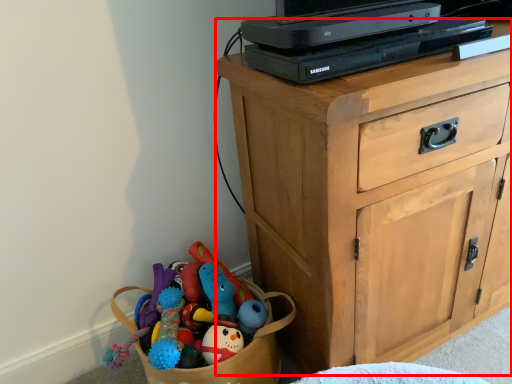
Question: From the image's perspective, considering the relative positions of chest of drawers (annotated by the red box) and computer in the image provided, where is chest of drawers (annotated by the red box) located with respect to the staircase?

Choices:
 (A) above
 (B) below

Answer: (B)